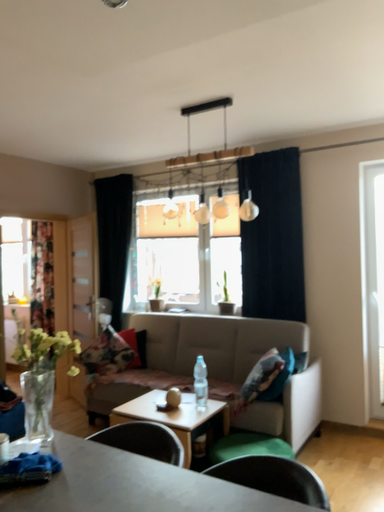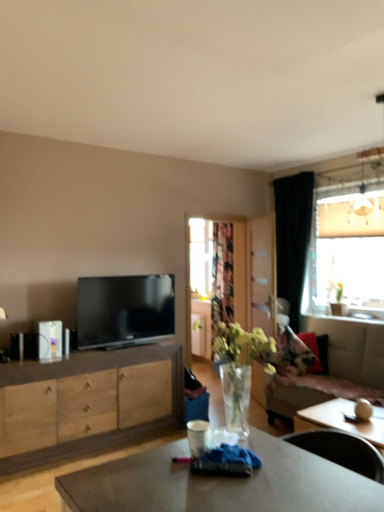
Question: Which way did the camera rotate in the video?

Choices:
 (A) rotated right
 (B) rotated left

Answer: (B)